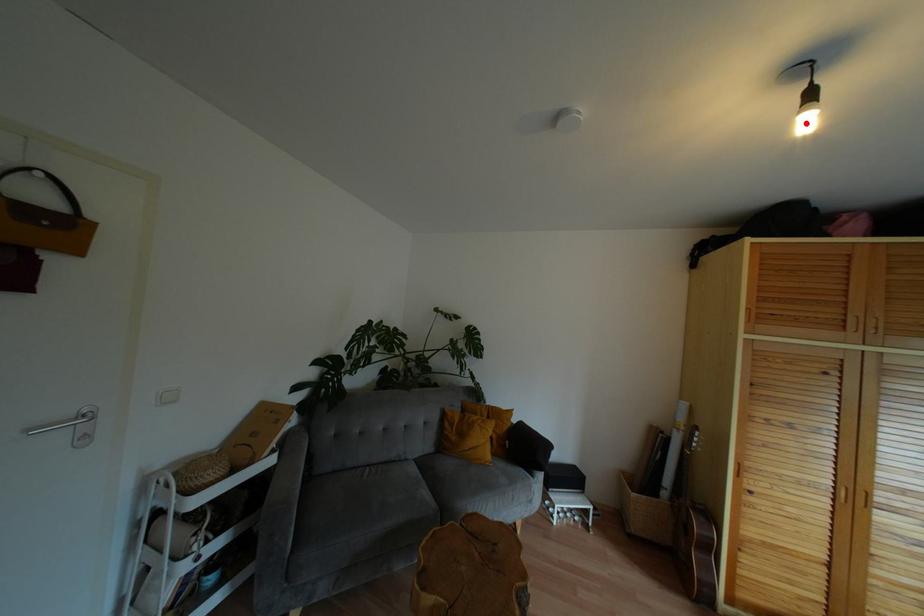
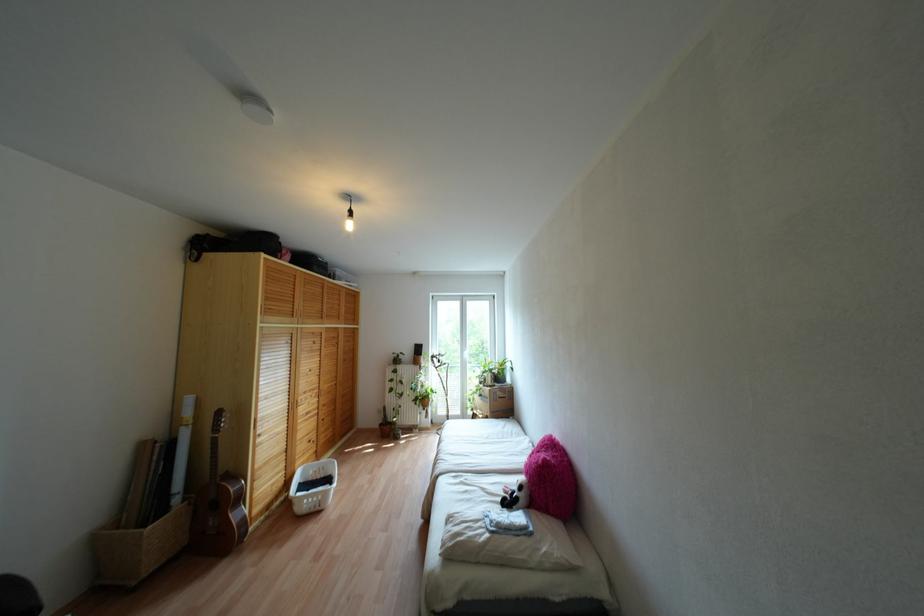
Locate, in the second image, the point that corresponds to the highlighted location in the first image.

(348, 225)